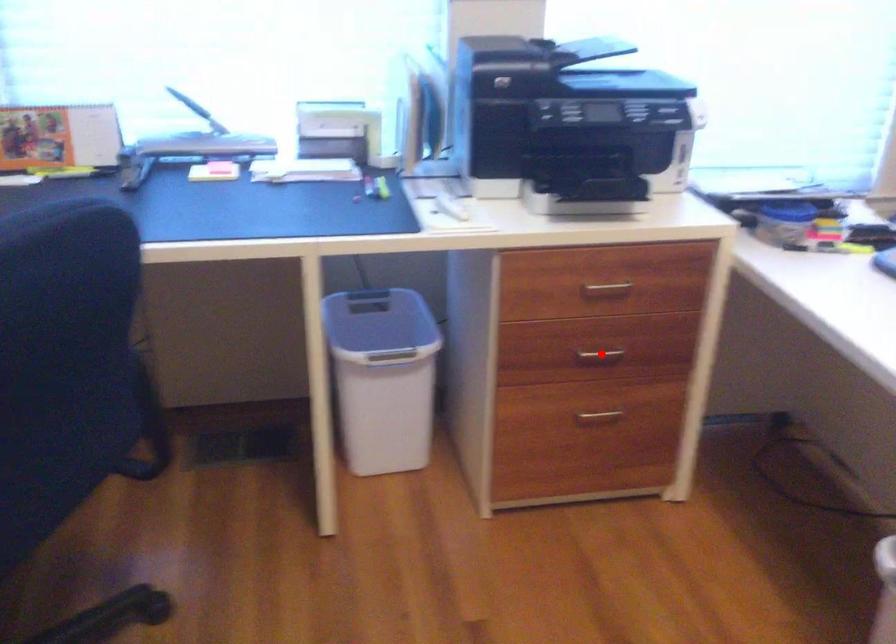
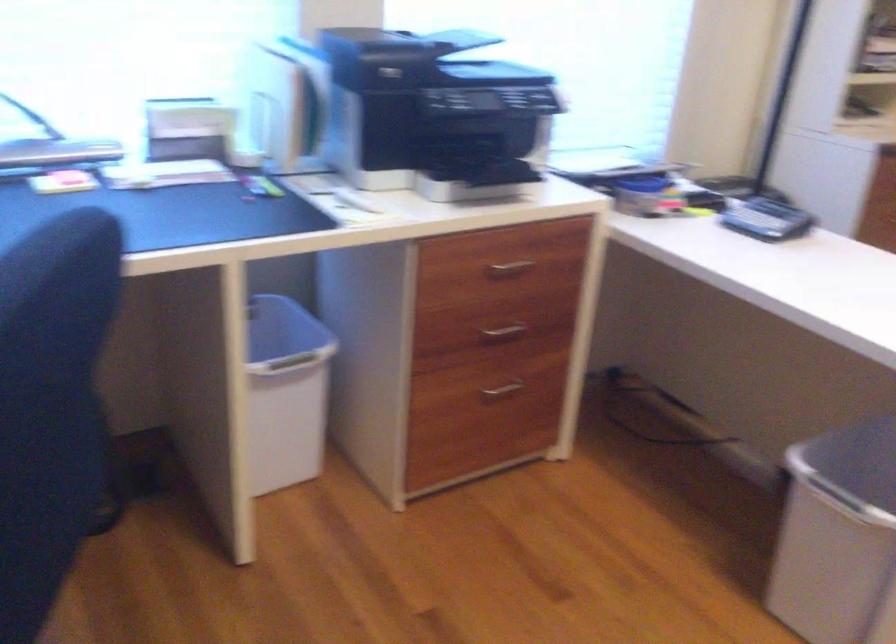
Where in the second image is the point corresponding to the highlighted location from the first image?

(503, 330)